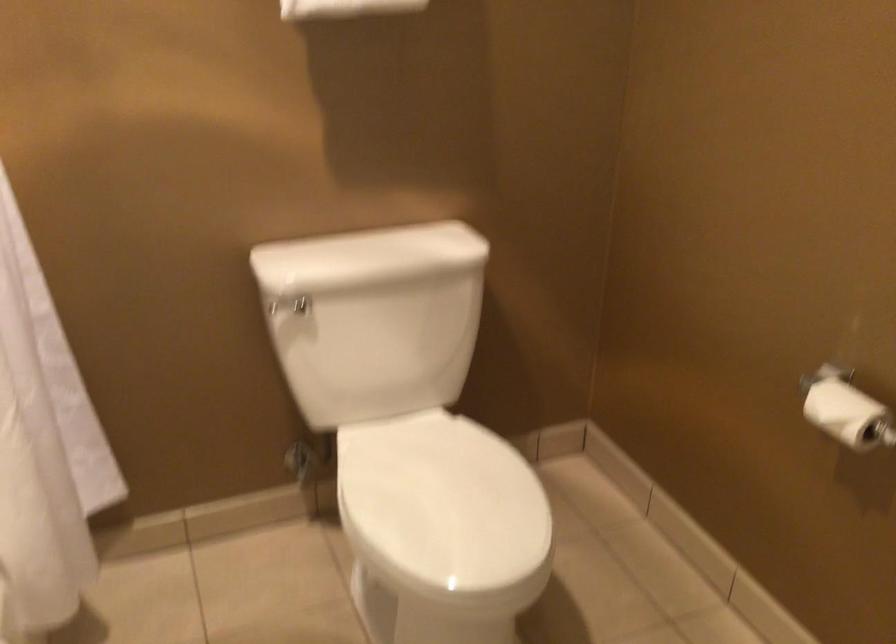
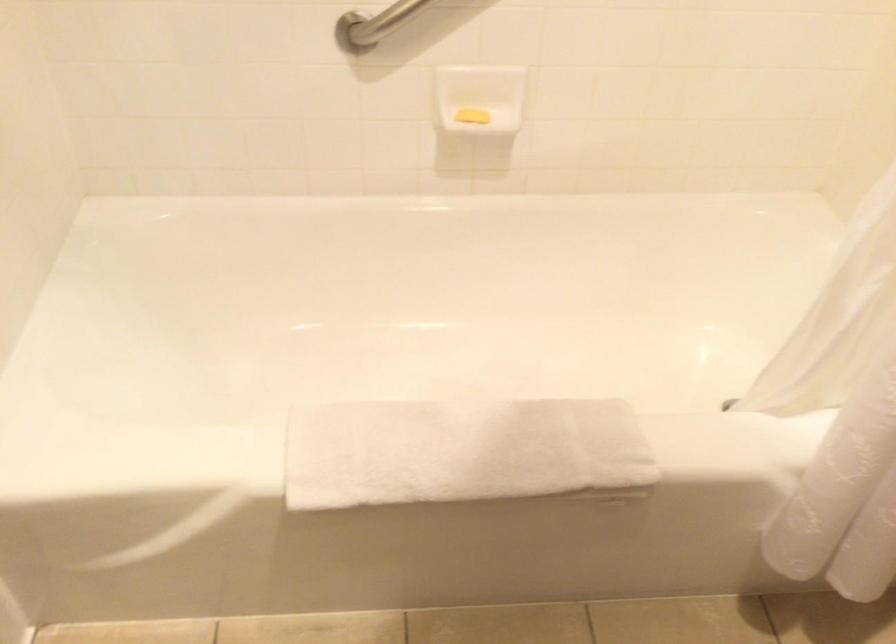
The images are taken continuously from a first-person perspective. In which direction is your viewpoint rotating?

The camera's rotation is toward left-down.